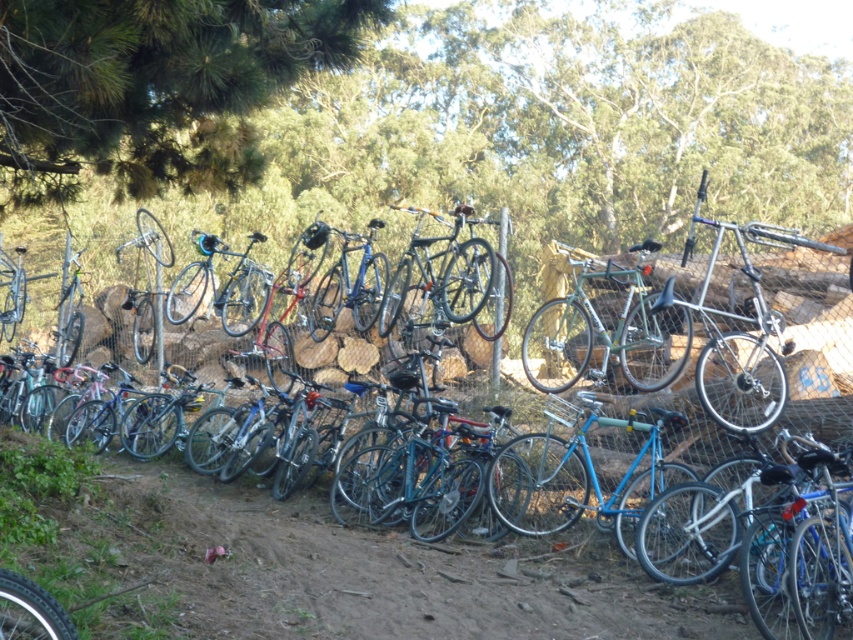
Who is higher up, shiny silver bicycle at center or green matte bicycle at center?

green matte bicycle at center is above.

Who is more distant from viewer, (90,547) or (625,356)?

Point (625,356)

Find the location of `shiny silver bicycle at center`. shiny silver bicycle at center is located at coordinates (311, 564).

Where is `shiny silver bicycle at center`? The image size is (853, 640). shiny silver bicycle at center is located at coordinates (311, 564).

Is shiny silver bicycle at center shorter than green leafy tree at upper left?

Yes.

Is shiny silver bicycle at center bigger than green leafy tree at upper left?

Indeed, shiny silver bicycle at center has a larger size compared to green leafy tree at upper left.

Measure the distance between shiny silver bicycle at center and camera.

3.84 meters

Where is `shiny silver bicycle at center`? This screenshot has width=853, height=640. shiny silver bicycle at center is located at coordinates (311, 564).

Is the position of green leafy tree at upper left less distant than that of green matte bicycle at center?

No, it is behind green matte bicycle at center.

Who is taller, green leafy tree at upper left or green matte bicycle at center?

Standing taller between the two is green matte bicycle at center.

Who is more forward, (173, 38) or (543, 332)?

Point (173, 38) is in front.

Locate an element on the screen. This screenshot has height=640, width=853. green leafy tree at upper left is located at coordinates (154, 86).